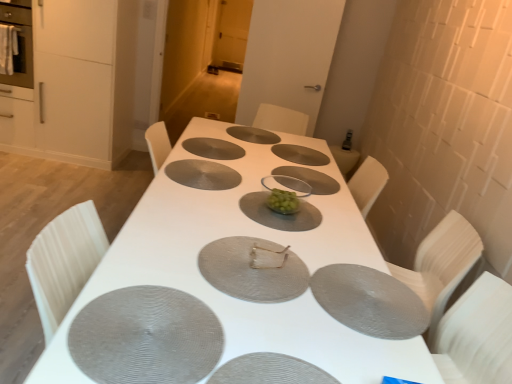
What are the coordinates of `vacant space in matte gray pizza pan at center, which is counted as the 7th pizza pan, starting from the front (from a real-world perspective)` in the screenshot? It's located at (292, 152).